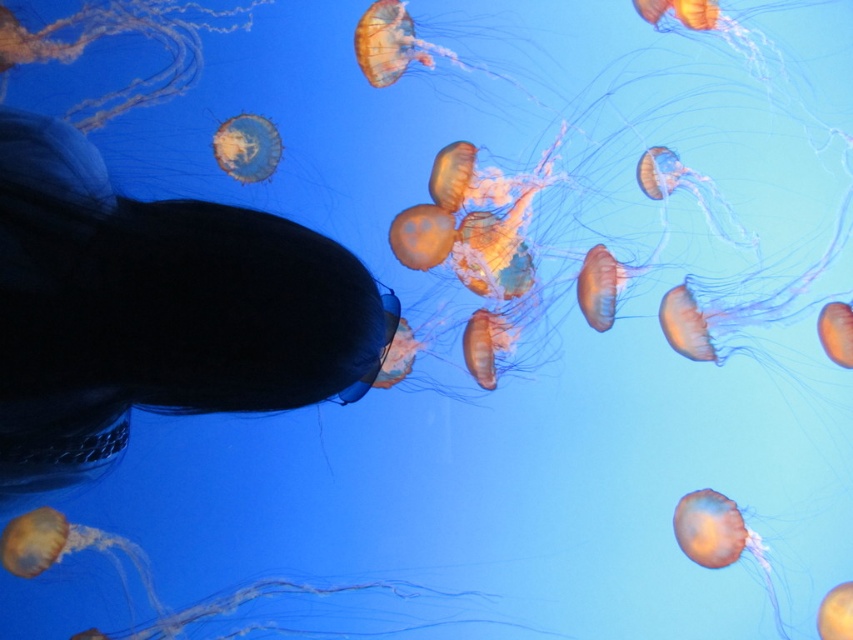
You are a diver swimming underwater and see the translucent orange jellyfish at lower right and the translucent orange jellyfish at upper center. Which jellyfish is closer to your head?

The translucent orange jellyfish at lower right is closer to your head because it is located below the translucent orange jellyfish at upper center, meaning it is nearer to the diver observing from below.

You are scuba diving and want to take a photo of the translucent orange jellyfish at lower right. Your camera has a focus point at coordinate point (718, 538). Is the jellyfish at that point?

Yes, the translucent orange jellyfish at lower right is located at point (718, 538).